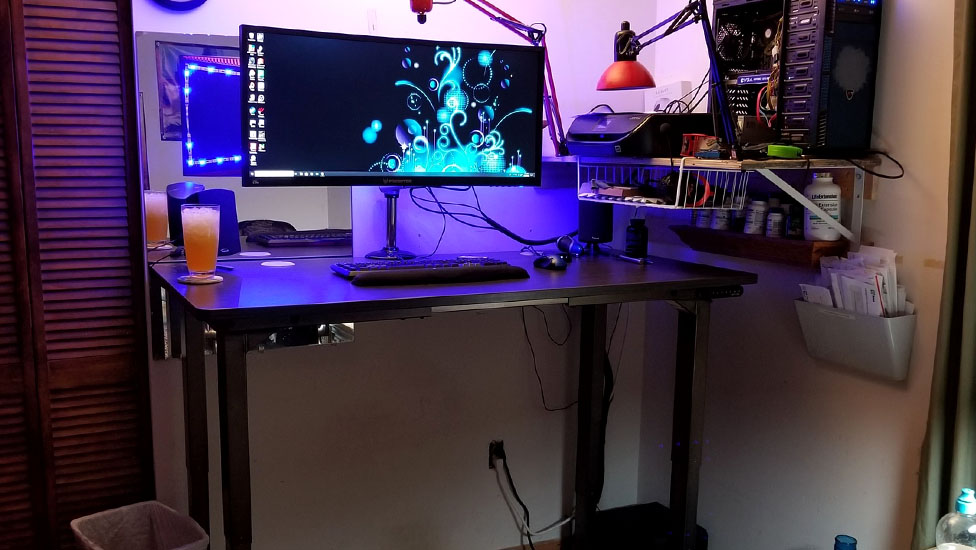
Image resolution: width=976 pixels, height=550 pixels. Identify the location of trash bag. (167, 532).